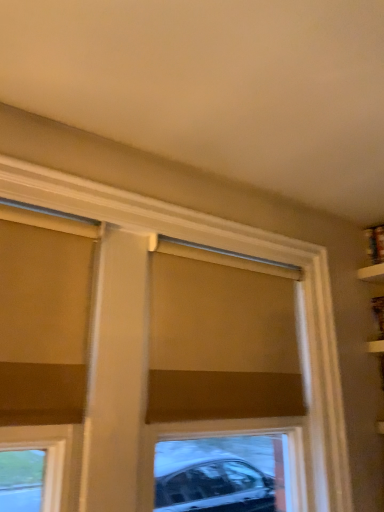
The height and width of the screenshot is (512, 384). Describe the element at coordinates (222, 387) in the screenshot. I see `matte brown screen door at center` at that location.

Where is `matte brown screen door at center`? The image size is (384, 512). matte brown screen door at center is located at coordinates (222, 387).

Identify the location of matte brown screen door at center. This screenshot has height=512, width=384. (222, 387).